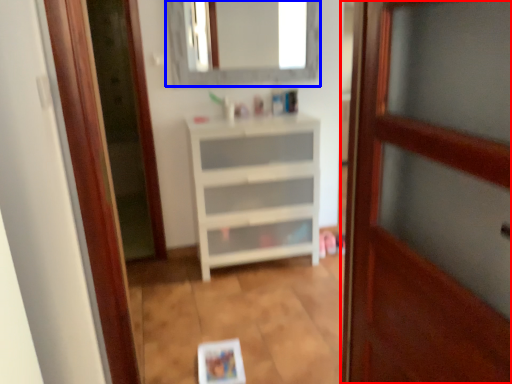
Question: Which object appears closest to the camera in this image, door (highlighted by a red box) or mirror (highlighted by a blue box)?

Choices:
 (A) door
 (B) mirror

Answer: (A)